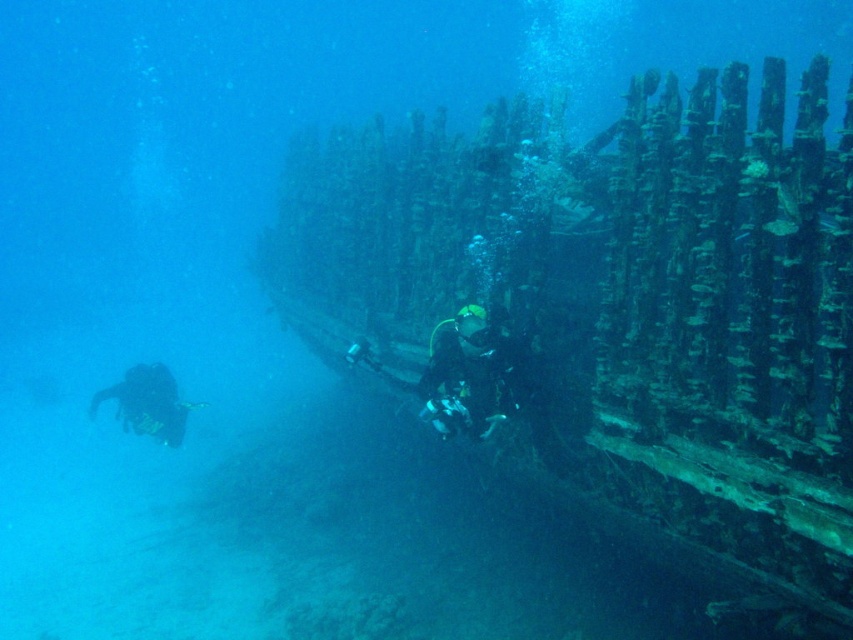
Where is `black matte diving suit at center`? black matte diving suit at center is located at coordinates (465, 376).

Is black matte diving suit at center smaller than black scuba diver at lower left?

Correct, black matte diving suit at center occupies less space than black scuba diver at lower left.

Between point (473, 387) and point (177, 412), which one is positioned behind?

Point (177, 412)

Locate an element on the screen. The width and height of the screenshot is (853, 640). black matte diving suit at center is located at coordinates 465,376.